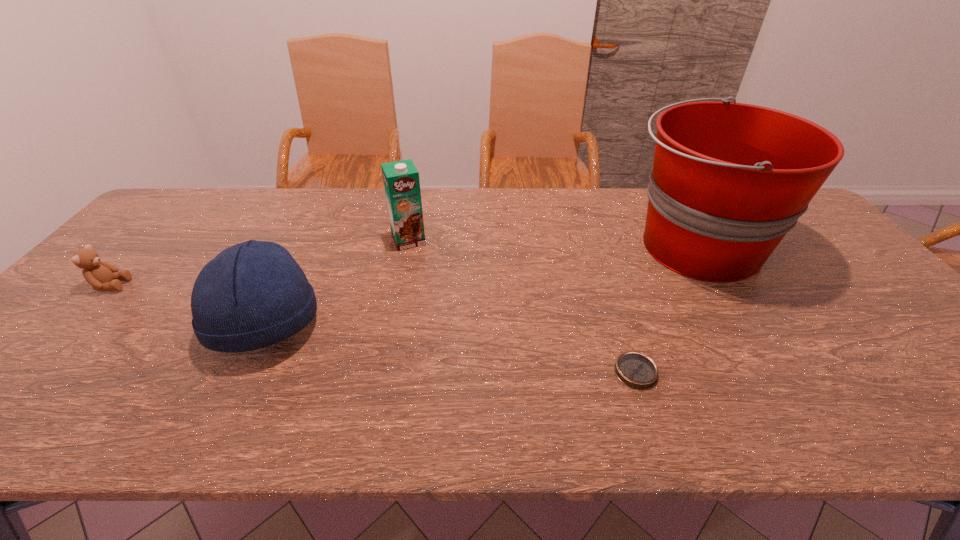
Locate an element on the screen. empty space between the bucket and the shortest object is located at coordinates (665, 309).

The image size is (960, 540). Find the location of `object that is the third closest to the third object from left to right`. object that is the third closest to the third object from left to right is located at coordinates (636, 370).

Locate an element on the screen. the closest object to the third object from left to right is located at coordinates (254, 294).

Locate an element on the screen. Image resolution: width=960 pixels, height=540 pixels. vacant region that satisfies the following two spatial constraints: 1. on the front side of the rightmost object; 2. on the right side of the second tallest object is located at coordinates (407, 246).

This screenshot has height=540, width=960. In order to click on vacant region that satisfies the following two spatial constraints: 1. on the front side of the shortest object; 2. on the left side of the fourth object from right to left in this screenshot , I will do point(242,372).

The height and width of the screenshot is (540, 960). Find the location of `vacant region that satisfies the following two spatial constraints: 1. on the front-facing side of the compass; 2. on the left side of the fourth tallest object`. vacant region that satisfies the following two spatial constraints: 1. on the front-facing side of the compass; 2. on the left side of the fourth tallest object is located at coordinates (30, 372).

This screenshot has height=540, width=960. What are the coordinates of `vacant region that satisfies the following two spatial constraints: 1. on the front-facing side of the teddy bear; 2. on the left side of the compass` in the screenshot? It's located at (30, 372).

What are the coordinates of `free region that satisfies the following two spatial constraints: 1. on the front-facing side of the leftmost object; 2. on the right side of the compass` in the screenshot? It's located at (30, 372).

This screenshot has width=960, height=540. In order to click on free space that satisfies the following two spatial constraints: 1. on the front side of the compass; 2. on the left side of the fourth shortest object in this screenshot , I will do `click(381, 372)`.

The image size is (960, 540). Find the location of `free space that satisfies the following two spatial constraints: 1. on the back side of the shortest object; 2. on the front-facing side of the teddy bear`. free space that satisfies the following two spatial constraints: 1. on the back side of the shortest object; 2. on the front-facing side of the teddy bear is located at coordinates (608, 285).